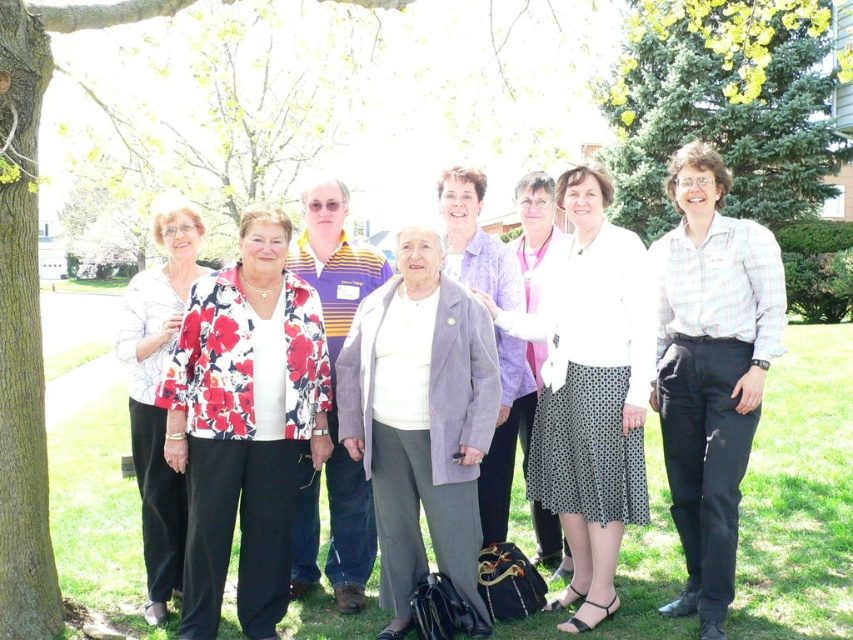
Question: Is polka dot skirt at center in front of striped polo shirt at center?

Choices:
 (A) yes
 (B) no

Answer: (A)

Question: Which object is closer to the camera taking this photo?

Choices:
 (A) green evergreen tree at upper right
 (B) plaid shirt at center
 (C) light gray fabric jacket at center
 (D) floral-patterned fabric at left

Answer: (B)

Question: Considering the real-world distances, which object is farthest from the purple fabric jacket at center?

Choices:
 (A) floral print blouse at center
 (B) green evergreen tree at upper right
 (C) polka dot skirt at center

Answer: (B)

Question: Can you confirm if polka dot skirt at center is wider than light gray fabric jacket at center?

Choices:
 (A) yes
 (B) no

Answer: (A)

Question: Which of the following is the farthest from the observer?

Choices:
 (A) floral print blouse at center
 (B) purple fabric jacket at center
 (C) plaid shirt at center
 (D) light purple fabric jacket at center

Answer: (B)

Question: From the image, what is the correct spatial relationship of floral print blouse at center in relation to purple fabric jacket at center?

Choices:
 (A) right
 (B) left

Answer: (B)